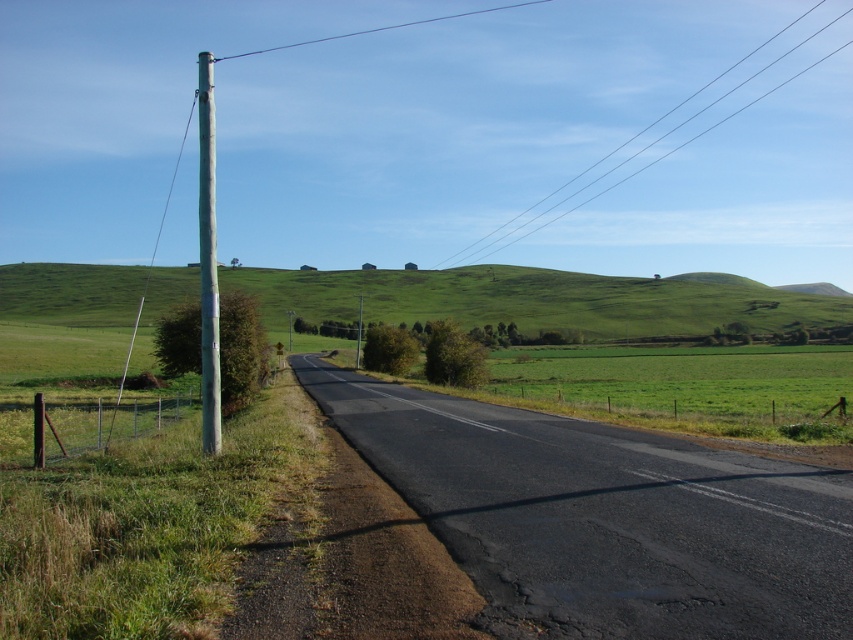
Question: Which of the following is the farthest from the observer?

Choices:
 (A) clear wire at upper center
 (B) metallic gray pole at left

Answer: (A)

Question: Does clear wire at upper center have a smaller size compared to smooth wire at upper center?

Choices:
 (A) no
 (B) yes

Answer: (A)

Question: Which of the following is the farthest from the observer?

Choices:
 (A) smooth wire at upper center
 (B) green grassy hillside at upper center
 (C) metallic gray pole at left
 (D) clear wire at upper center

Answer: (A)

Question: Which object appears farthest from the camera in this image?

Choices:
 (A) smooth wire at upper center
 (B) green grassy hillside at upper center
 (C) metallic gray pole at left

Answer: (A)

Question: Is metallic gray pole at left thinner than smooth wire at upper center?

Choices:
 (A) no
 (B) yes

Answer: (B)

Question: Can you confirm if clear wire at upper center is thinner than smooth wire at upper center?

Choices:
 (A) no
 (B) yes

Answer: (A)